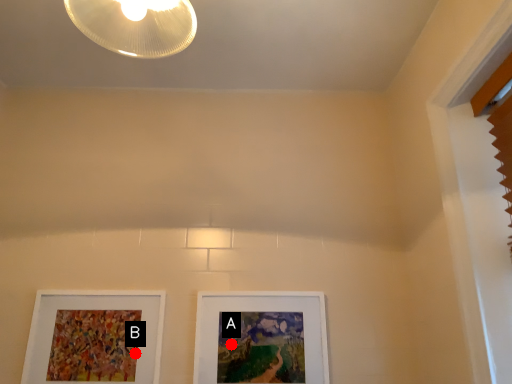
Question: Two points are circled on the image, labeled by A and B beside each circle. Which point is farther to the camera?

Choices:
 (A) A is further
 (B) B is further

Answer: (A)